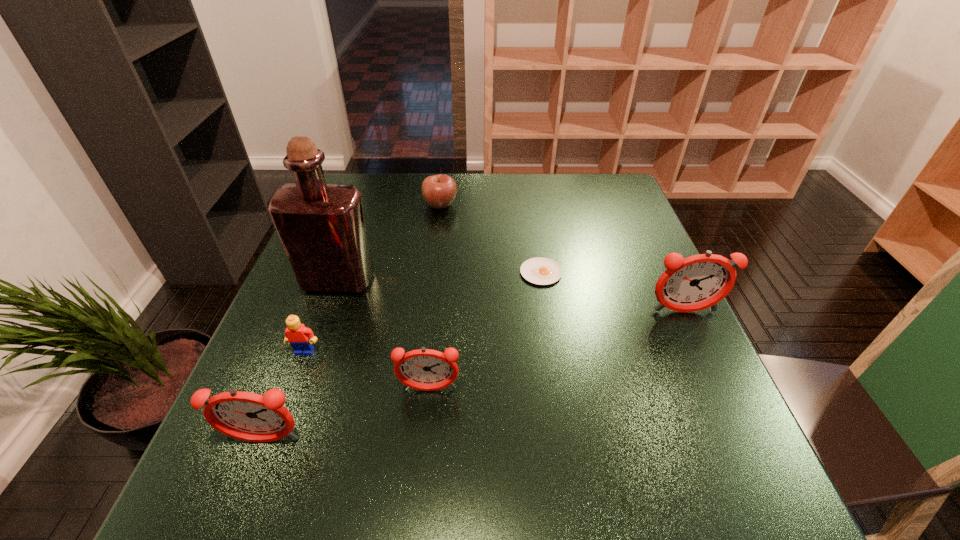
Locate an element on the screen. The width and height of the screenshot is (960, 540). free space between the farthest object and the third tallest object is located at coordinates (352, 322).

Select which object appears as the closest to the nearest object. Please provide its 2D coordinates. Your answer should be formatted as a tuple, i.e. [(x, y)], where the tuple contains the x and y coordinates of a point satisfying the conditions above.

[(424, 369)]

Select which object is the fourth closest to the fourth shortest object. Please provide its 2D coordinates. Your answer should be formatted as a tuple, i.e. [(x, y)], where the tuple contains the x and y coordinates of a point satisfying the conditions above.

[(542, 271)]

The width and height of the screenshot is (960, 540). Find the location of `alarm clock that stands as the closest to the second object from right to left`. alarm clock that stands as the closest to the second object from right to left is located at coordinates (691, 284).

At what (x,y) coordinates should I click in order to perform the action: click on the second closest alarm clock relative to the nearest object. Please return your answer as a coordinate pair (x, y). The height and width of the screenshot is (540, 960). Looking at the image, I should click on (691, 284).